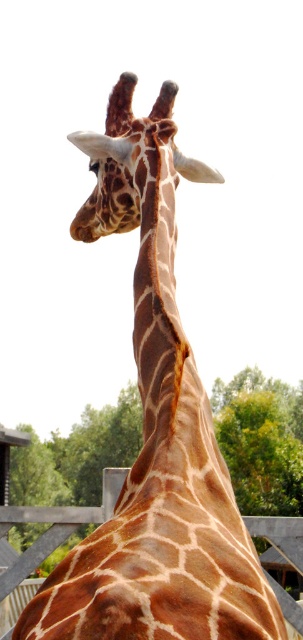
Question: Estimate the real-world distances between objects in this image. Which object is farther from the brown wooden fence at lower center?

Choices:
 (A) spotted fur giraffe head at center
 (B) brown textured neck at center

Answer: (A)

Question: Does brown textured neck at center have a smaller size compared to spotted fur giraffe head at center?

Choices:
 (A) yes
 (B) no

Answer: (B)

Question: Is spotted fur giraffe head at center thinner than brown wooden fence at lower center?

Choices:
 (A) yes
 (B) no

Answer: (A)

Question: Is brown textured neck at center positioned behind spotted fur giraffe head at center?

Choices:
 (A) no
 (B) yes

Answer: (A)

Question: Among these points, which one is nearest to the camera?

Choices:
 (A) (x=283, y=547)
 (B) (x=166, y=205)
 (C) (x=123, y=108)

Answer: (B)

Question: Considering the real-world distances, which object is farthest from the spotted fur giraffe head at center?

Choices:
 (A) brown textured neck at center
 (B) brown wooden fence at lower center

Answer: (B)